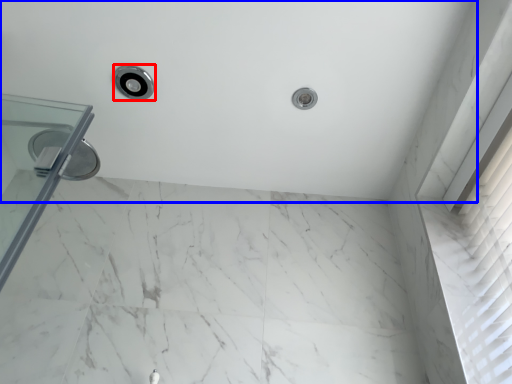
Question: Among these objects, which one is farthest to the camera, shower (highlighted by a red box) or bath (highlighted by a blue box)?

Choices:
 (A) shower
 (B) bath

Answer: (A)